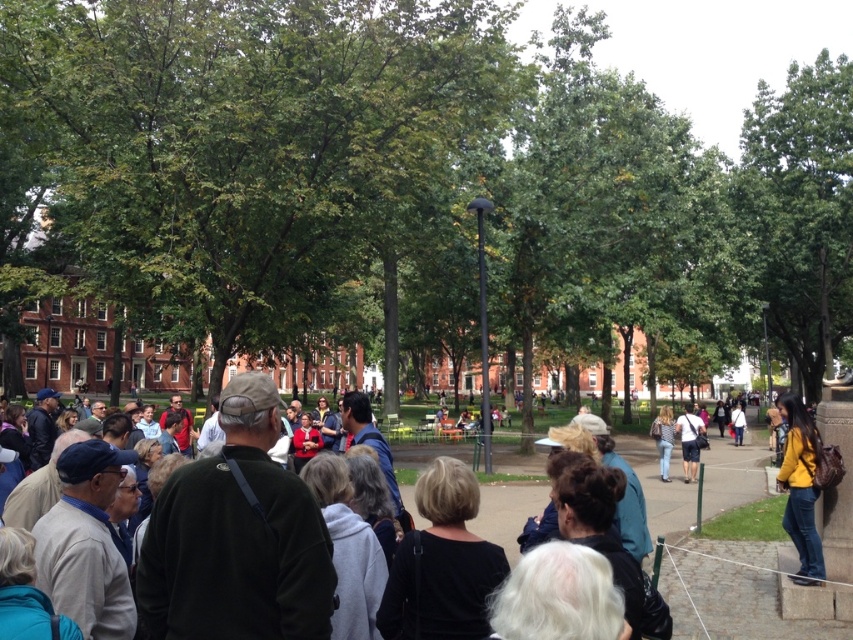
Between dark green sweater at center and green leafy tree at upper right, which one appears on the right side from the viewer's perspective?

green leafy tree at upper right is more to the right.

Who is higher up, dark green sweater at center or green leafy tree at upper right?

Positioned higher is green leafy tree at upper right.

The height and width of the screenshot is (640, 853). What do you see at coordinates (236, 538) in the screenshot?
I see `dark green sweater at center` at bounding box center [236, 538].

At what (x,y) coordinates should I click in order to perform the action: click on dark green sweater at center. Please return your answer as a coordinate pair (x, y). This screenshot has height=640, width=853. Looking at the image, I should click on (236, 538).

Can you confirm if black matte jacket at center is thinner than denim shorts at center?

Indeed, black matte jacket at center has a lesser width compared to denim shorts at center.

Does black matte jacket at center have a smaller size compared to denim shorts at center?

Yes, black matte jacket at center is smaller than denim shorts at center.

You are a GUI agent. You are given a task and a screenshot of the screen. Output one action in this format:
    pyautogui.click(x=<x>, y=<y>)
    Task: Click on the black matte jacket at center
    This screenshot has width=853, height=640.
    Given the screenshot: What is the action you would take?
    pyautogui.click(x=440, y=563)

Locate an element on the screen. The height and width of the screenshot is (640, 853). black matte jacket at center is located at coordinates (440, 563).

Who is more forward, (84,120) or (700,432)?

Point (84,120)

Does green leafy tree at center have a smaller size compared to denim shorts at center?

No.

The height and width of the screenshot is (640, 853). What do you see at coordinates (245, 145) in the screenshot?
I see `green leafy tree at center` at bounding box center [245, 145].

This screenshot has height=640, width=853. Identify the location of green leafy tree at center. (245, 145).